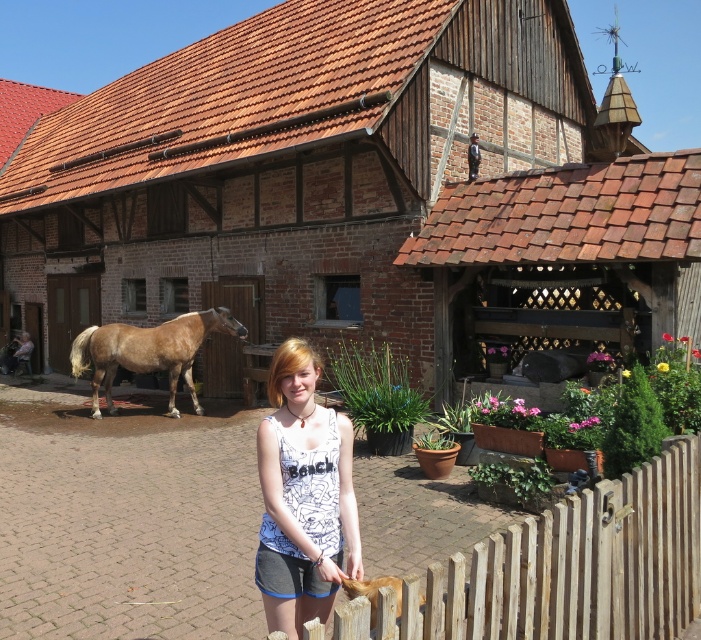
Which is behind, point (573, 500) or point (72, 344)?

The point (72, 344) is more distant.

Which is behind, point (461, 554) or point (74, 340)?

The point (74, 340) is behind.

Where is `light brown wooden fence at lower right`? Image resolution: width=701 pixels, height=640 pixels. light brown wooden fence at lower right is located at coordinates (566, 568).

Does light brown wooden fence at lower right have a greater height compared to white printed tank top at center?

No, light brown wooden fence at lower right is not taller than white printed tank top at center.

The height and width of the screenshot is (640, 701). I want to click on light brown wooden fence at lower right, so click(x=566, y=568).

Can you confirm if brown wooden barn at center is positioned below light brown wooden fence at lower right?

Actually, brown wooden barn at center is above light brown wooden fence at lower right.

Does point (484, 221) lie behind point (695, 512)?

Yes.

Locate an element on the screen. The image size is (701, 640). brown wooden barn at center is located at coordinates (360, 189).

Identify the location of brown wooden barn at center. This screenshot has height=640, width=701. (360, 189).